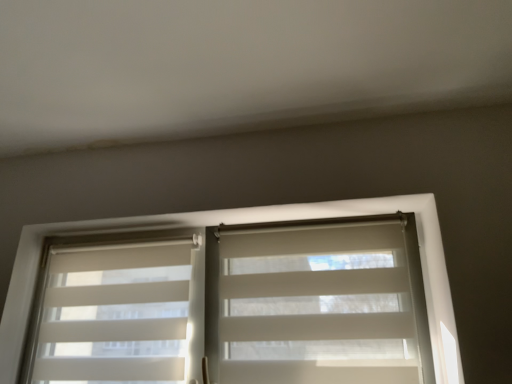
This screenshot has height=384, width=512. Identify the location of white textured blinds at left. (116, 313).

From the image's perspective, which one is positioned higher, white textured blinds at left or white translucent blinds at center?

white translucent blinds at center.

Visually, is white textured blinds at left positioned to the left or to the right of white translucent blinds at center?

From the image, it's evident that white textured blinds at left is to the left of white translucent blinds at center.

Where is `window above the white textured blinds at left (from a real-world perspective)`? window above the white textured blinds at left (from a real-world perspective) is located at coordinates (249, 222).

Is white fabric blind at center wider than white textured blinds at left?

Correct, the width of white fabric blind at center exceeds that of white textured blinds at left.

Locate an element on the screen. The height and width of the screenshot is (384, 512). shutter behind the white fabric blind at center is located at coordinates (116, 313).

Which object is more forward, white fabric blind at center or white textured blinds at left?

white fabric blind at center is more forward.

Could you tell me if white fabric blind at center is turned towards white textured blinds at left?

No, white fabric blind at center is not facing towards white textured blinds at left.

Which is correct: white translucent blinds at center is inside white fabric blind at center, or outside of it?

white translucent blinds at center is outside white fabric blind at center.

From the image's perspective, would you say white translucent blinds at center is shown under white fabric blind at center?

Correct, white translucent blinds at center appears lower than white fabric blind at center in the image.

Is white translucent blinds at center to the left or to the right of white fabric blind at center in the image?

In the image, white translucent blinds at center appears on the left side of white fabric blind at center.

Considering the sizes of white translucent blinds at center and white fabric blind at center in the image, is white translucent blinds at center wider or thinner than white fabric blind at center?

Clearly, white translucent blinds at center has more width compared to white fabric blind at center.

Find the location of `shutter located below the white fabric blind at center (from the image's perspective)`. shutter located below the white fabric blind at center (from the image's perspective) is located at coordinates (116, 313).

From a real-world perspective, does white textured blinds at left sit lower than white fabric blind at center?

No.

From the image's perspective, is white textured blinds at left above or below white fabric blind at center?

white textured blinds at left is below white fabric blind at center.

Is white textured blinds at left taller or shorter than white fabric blind at center?

Clearly, white textured blinds at left is taller compared to white fabric blind at center.

How different are the orientations of white fabric blind at center and white translucent blinds at center in degrees?

white fabric blind at center and white translucent blinds at center are facing 0.000462 degrees away from each other.

Is white fabric blind at center placed right next to white translucent blinds at center?

No, white fabric blind at center is not touching white translucent blinds at center.

Which point is more distant from viewer, (308, 354) or (442, 318)?

The point (308, 354) is farther.

Which is behind, white fabric blind at center or white translucent blinds at center?

white translucent blinds at center.

Considering the relative sizes of white translucent blinds at center and white textured blinds at left in the image provided, is white translucent blinds at center thinner than white textured blinds at left?

In fact, white translucent blinds at center might be wider than white textured blinds at left.

Considering the sizes of objects white translucent blinds at center and white textured blinds at left in the image provided, who is shorter, white translucent blinds at center or white textured blinds at left?

white textured blinds at left.

Is white translucent blinds at center looking in the opposite direction of white textured blinds at left?

That's right, white translucent blinds at center is facing away from white textured blinds at left.

From a real-world perspective, which is physically below, white translucent blinds at center or white textured blinds at left?

From a 3D spatial view, white textured blinds at left is below.

Locate an element on the screen. The height and width of the screenshot is (384, 512). shutter lying on the left of white translucent blinds at center is located at coordinates (116, 313).

At what (x,y) coordinates should I click in order to perform the action: click on shutter located below the white fabric blind at center (from the image's perspective). Please return your answer as a coordinate pair (x, y). Looking at the image, I should click on (116, 313).

Estimate the real-world distances between objects in this image. Which object is further from white textured blinds at left, white fabric blind at center or white translucent blinds at center?

Among the two, white fabric blind at center is located further to white textured blinds at left.

Which object lies nearer to the anchor point white fabric blind at center, white textured blinds at left or white translucent blinds at center?

white translucent blinds at center lies closer to white fabric blind at center than the other object.

When comparing their distances from white translucent blinds at center, does white fabric blind at center or white textured blinds at left seem further?

Based on the image, white fabric blind at center appears to be further to white translucent blinds at center.

From the image, which object appears to be nearer to white fabric blind at center, white translucent blinds at center or white textured blinds at left?

white translucent blinds at center.

From the image, which object appears to be farther from white translucent blinds at center, white textured blinds at left or white fabric blind at center?

white fabric blind at center is further to white translucent blinds at center.

When comparing their distances from white textured blinds at left, does white translucent blinds at center or white fabric blind at center seem further?

Based on the image, white fabric blind at center appears to be further to white textured blinds at left.

Identify the location of window between white textured blinds at left and white fabric blind at center. Image resolution: width=512 pixels, height=384 pixels. (249, 222).